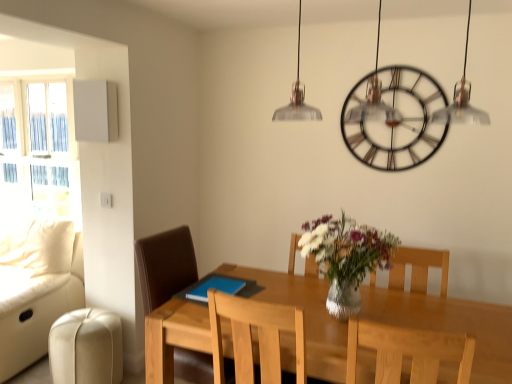
You are a GUI agent. You are given a task and a screenshot of the screen. Output one action in this format:
    pyautogui.click(x=<x>, y=<y>)
    Task: Click on the free spot to the right of clear glass vase at center
    
    Given the screenshot: What is the action you would take?
    pyautogui.click(x=419, y=315)